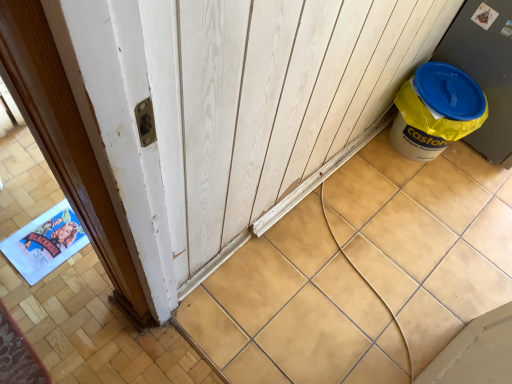
Question: Is wooden at lower right at the back of yellow plastic canister at right?

Choices:
 (A) no
 (B) yes

Answer: (A)

Question: Does yellow plastic canister at right turn towards wooden at lower right?

Choices:
 (A) no
 (B) yes

Answer: (A)

Question: From a real-world perspective, is yellow plastic canister at right positioned under wooden at lower right based on gravity?

Choices:
 (A) yes
 (B) no

Answer: (B)

Question: Does yellow plastic canister at right have a greater height compared to wooden at lower right?

Choices:
 (A) yes
 (B) no

Answer: (A)

Question: Can you confirm if yellow plastic canister at right is smaller than wooden at lower right?

Choices:
 (A) no
 (B) yes

Answer: (B)

Question: Is yellow plastic canister at right behind wooden at lower right?

Choices:
 (A) yes
 (B) no

Answer: (A)

Question: From a real-world perspective, is wooden at lower right located higher than yellow plastic canister at right?

Choices:
 (A) no
 (B) yes

Answer: (A)

Question: Considering the relative positions of wooden at lower right and yellow plastic canister at right in the image provided, is wooden at lower right to the right of yellow plastic canister at right from the viewer's perspective?

Choices:
 (A) no
 (B) yes

Answer: (A)

Question: Is wooden at lower right next to yellow plastic canister at right?

Choices:
 (A) yes
 (B) no

Answer: (B)

Question: Is yellow plastic canister at right surrounded by wooden at lower right?

Choices:
 (A) yes
 (B) no

Answer: (B)

Question: Can you confirm if wooden at lower right is wider than yellow plastic canister at right?

Choices:
 (A) yes
 (B) no

Answer: (A)

Question: Is wooden at lower right positioned before yellow plastic canister at right?

Choices:
 (A) yes
 (B) no

Answer: (A)

Question: Is yellow plastic canister at right inside or outside of wooden at lower right?

Choices:
 (A) inside
 (B) outside

Answer: (B)